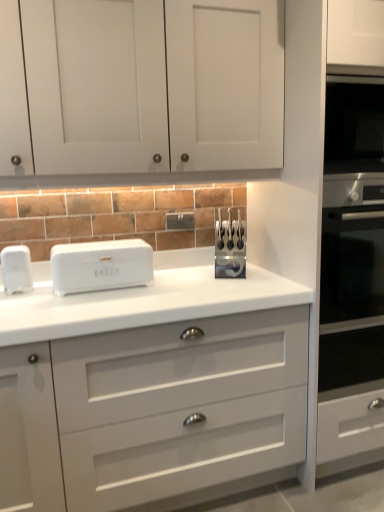
Question: Is white glossy chest of drawers at center aimed at white glossy bread bin at center, positioned as the first home appliance in right-to-left order?

Choices:
 (A) yes
 (B) no

Answer: (B)

Question: Is white glossy chest of drawers at center to the right of white glossy bread bin at center, placed as the second home appliance when sorted from left to right, from the viewer's perspective?

Choices:
 (A) yes
 (B) no

Answer: (A)

Question: Is white glossy chest of drawers at center next to white glossy bread bin at center, placed as the second home appliance when sorted from left to right?

Choices:
 (A) no
 (B) yes

Answer: (A)

Question: Does white glossy chest of drawers at center have a lesser height compared to white glossy bread bin at center, positioned as the first home appliance in right-to-left order?

Choices:
 (A) yes
 (B) no

Answer: (B)

Question: Can you confirm if white glossy chest of drawers at center is wider than white glossy bread bin at center, placed as the second home appliance when sorted from left to right?

Choices:
 (A) yes
 (B) no

Answer: (A)

Question: Considering their positions, is white plastic electric outlet at center located in front of or behind white matte cabinet doors at upper center?

Choices:
 (A) front
 (B) behind

Answer: (B)

Question: From the image's perspective, relative to white matte cabinet doors at upper center, is white plastic electric outlet at center above or below?

Choices:
 (A) above
 (B) below

Answer: (B)

Question: From a real-world perspective, relative to white matte cabinet doors at upper center, is white plastic electric outlet at center vertically above or below?

Choices:
 (A) below
 (B) above

Answer: (A)

Question: Is white plastic electric outlet at center wider or thinner than white matte cabinet doors at upper center?

Choices:
 (A) wide
 (B) thin

Answer: (B)

Question: Considering the positions of white matte cabinet doors at upper center and white glossy chest of drawers at center in the image, is white matte cabinet doors at upper center bigger or smaller than white glossy chest of drawers at center?

Choices:
 (A) small
 (B) big

Answer: (A)

Question: Based on their positions, is white matte cabinet doors at upper center located to the left or right of white glossy chest of drawers at center?

Choices:
 (A) left
 (B) right

Answer: (B)

Question: Is point (127, 74) positioned closer to the camera than point (264, 325)?

Choices:
 (A) closer
 (B) farther

Answer: (A)

Question: From a real-world perspective, is white matte cabinet doors at upper center above or below white glossy chest of drawers at center?

Choices:
 (A) below
 (B) above

Answer: (B)

Question: Would you say white plastic electric outlet at center is to the left or to the right of white glossy chest of drawers at center in the picture?

Choices:
 (A) right
 (B) left

Answer: (A)

Question: In the image, is white plastic electric outlet at center positioned in front of or behind white glossy chest of drawers at center?

Choices:
 (A) front
 (B) behind

Answer: (B)